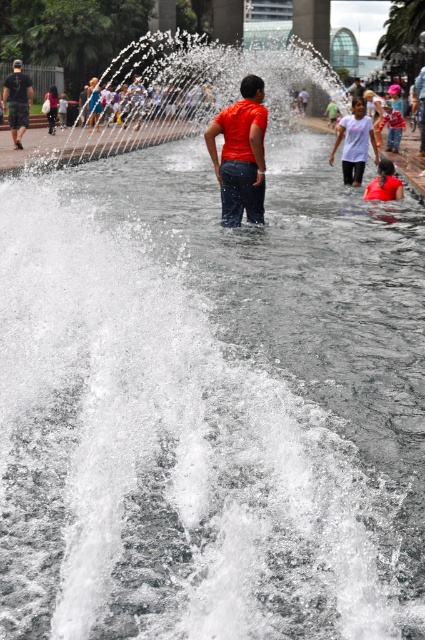
Does matte orange shirt at center appear over dark gray t-shirt at center?

No, matte orange shirt at center is not above dark gray t-shirt at center.

Describe the element at coordinates (240, 154) in the screenshot. I see `matte orange shirt at center` at that location.

Is point (257, 116) more distant than point (31, 90)?

That is False.

The width and height of the screenshot is (425, 640). I want to click on matte orange shirt at center, so click(x=240, y=154).

What do you see at coordinates (17, 100) in the screenshot? This screenshot has height=640, width=425. I see `dark gray t-shirt at center` at bounding box center [17, 100].

Between dark gray t-shirt at center and red shirt at center, which one appears on the left side from the viewer's perspective?

From the viewer's perspective, dark gray t-shirt at center appears more on the left side.

This screenshot has height=640, width=425. In order to click on dark gray t-shirt at center in this screenshot , I will do `click(17, 100)`.

Is matte orange shirt at center above white matte shirt at upper center?

Incorrect, matte orange shirt at center is not positioned above white matte shirt at upper center.

Can you confirm if matte orange shirt at center is positioned below white matte shirt at upper center?

Yes.

Who is more forward, (x=226, y=112) or (x=357, y=168)?

Point (x=226, y=112) is more forward.

The height and width of the screenshot is (640, 425). In order to click on matte orange shirt at center in this screenshot , I will do `click(240, 154)`.